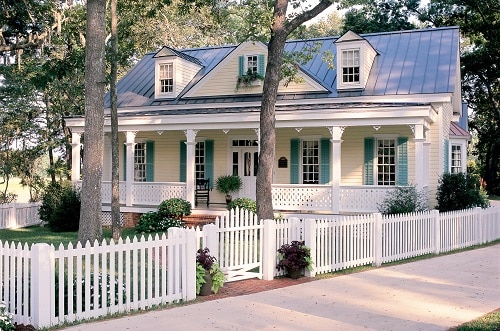
This screenshot has height=331, width=500. I want to click on chair, so click(202, 183).